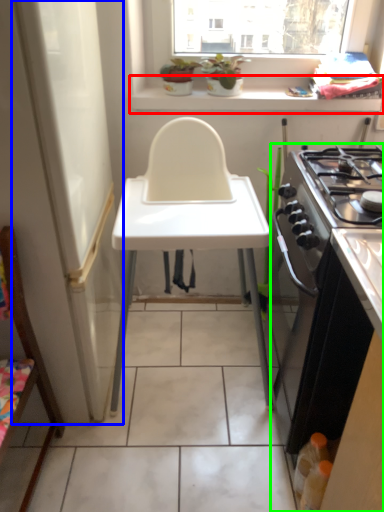
Question: Based on their relative distances, which object is nearer to window sill (highlighted by a red box)? Choose from screen door (highlighted by a blue box) and cabinetry (highlighted by a green box).

Choices:
 (A) screen door
 (B) cabinetry

Answer: (A)